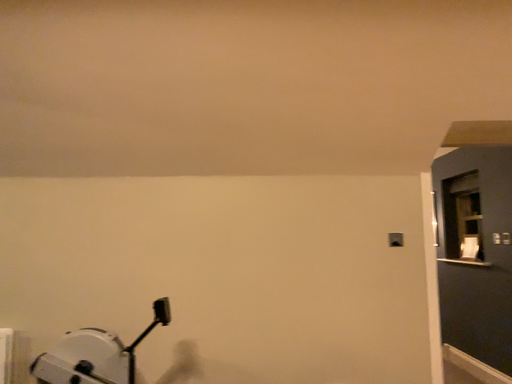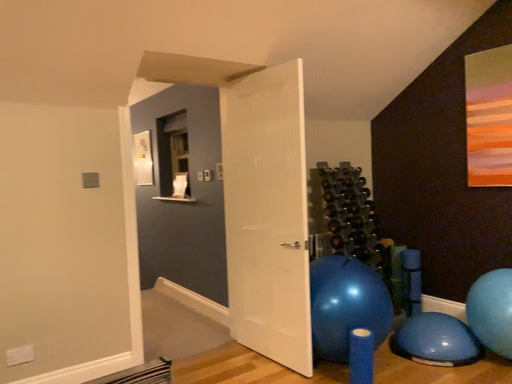
Question: How did the camera likely rotate when shooting the video?

Choices:
 (A) rotated left
 (B) rotated right

Answer: (B)